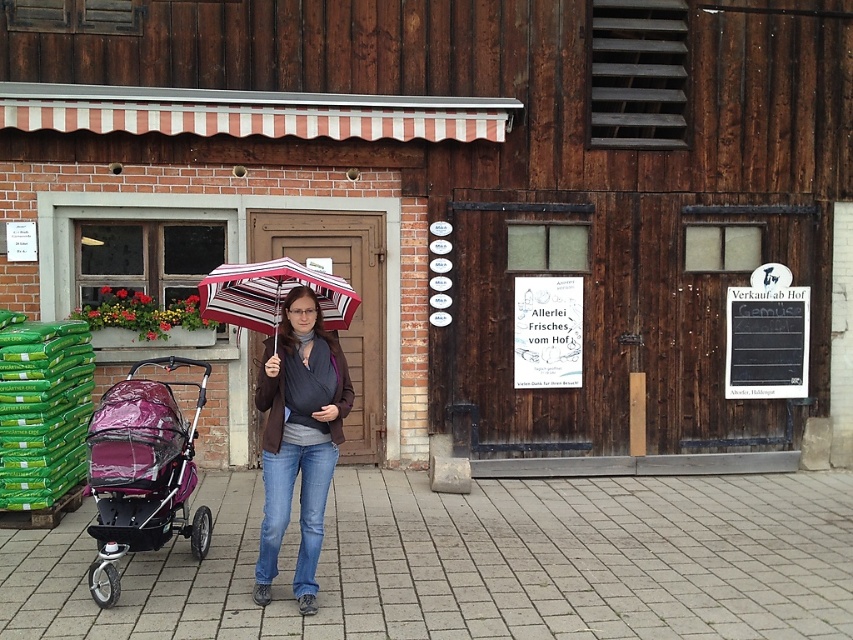
You are a parent pushing a purple glossy baby carriage at left along the gray concrete pavement at center. Can you continue moving forward without lifting the carriage?

The gray concrete pavement at center is positioned under purple glossy baby carriage at left, so yes, you can continue moving forward without lifting the carriage since the carriage is already on the pavement.

Based on the photo, you are a tourist visiting this European farm and see the matte brown jacket at center and the black chalkboard at right. Which object is nearer to you?

The matte brown jacket at center is closer to the viewer than the black chalkboard at right.